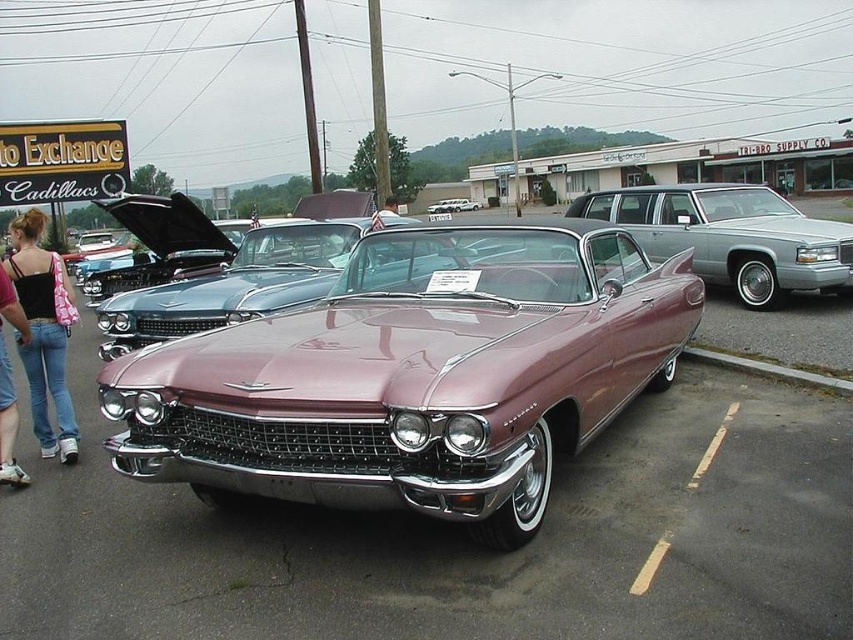
You are a photographer at the car show and want to capture both the metallic silver station wagon at center and the shiny chrome convertible at center in a single photo. However, the convertible is partially blocked by the station wagon. Can you adjust your position to include both vehicles without moving any of them?

The metallic silver station wagon at center is in front of the shiny chrome convertible at center, so you can move your position slightly to the side to capture both vehicles in the frame without moving them.

You are a photographer at the car show and want to capture both the pink denim jeans at lower left and the shiny chrome convertible at center in a single shot. Which object is positioned closer to the camera?

Result: The pink denim jeans at lower left is closer to the viewer than the shiny chrome convertible at center, so it will appear closer to the camera in the photo.

You are a parking attendant who needs to fit both the shiny maroon convertible at center and the metallic silver station wagon at center into a parking space that is 2.5 meters wide. Based on their widths, can both vehicles fit side by only if they are parked parallel to each other?

The shiny maroon convertible at center is wider than the metallic silver station wagon at center. Since the parking space is only 2.5 meters wide, it is unlikely both vehicles can fit side by side unless they are parked parallel to each other, but their combined width may exceed the space.